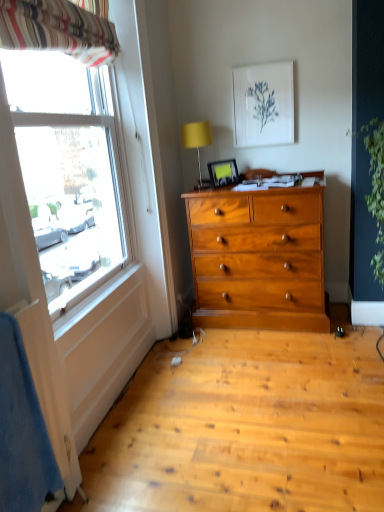
Question: Looking at their shapes, would you say matte plastic picture frame at upper center, the 2th picture frame when ordered from right to left, is wider or thinner than white paper at upper center, acting as the second picture frame starting from the bottom?

Choices:
 (A) wide
 (B) thin

Answer: (A)

Question: Which is correct: matte plastic picture frame at upper center, marked as the first picture frame in a left-to-right arrangement, is inside white paper at upper center, the 1th picture frame positioned from the right, or outside of it?

Choices:
 (A) outside
 (B) inside

Answer: (A)

Question: Which object is the closest to the white paper at upper center, acting as the second picture frame starting from the bottom?

Choices:
 (A) green leafy plant at right
 (B) yellow fabric lampshade at upper center
 (C) striped fabric curtain at upper left
 (D) matte plastic picture frame at upper center, which ranks as the second picture frame in top-to-bottom order

Answer: (B)

Question: Which object is positioned farthest from the yellow fabric lampshade at upper center?

Choices:
 (A) white paper at upper center, placed as the 2th picture frame when sorted from left to right
 (B) green leafy plant at right
 (C) striped fabric curtain at upper left
 (D) matte plastic picture frame at upper center, marked as the first picture frame in a left-to-right arrangement

Answer: (C)